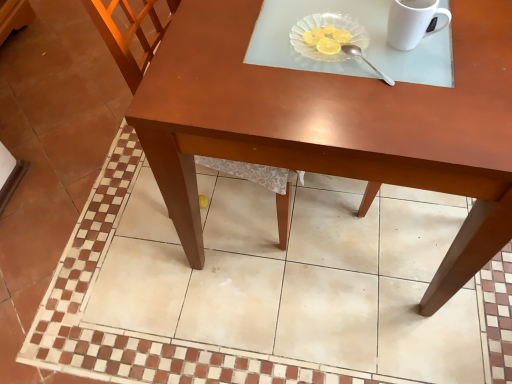
Locate an element on the screen. Image resolution: width=512 pixels, height=384 pixels. free space in front of transparent glass plate at upper center is located at coordinates (333, 99).